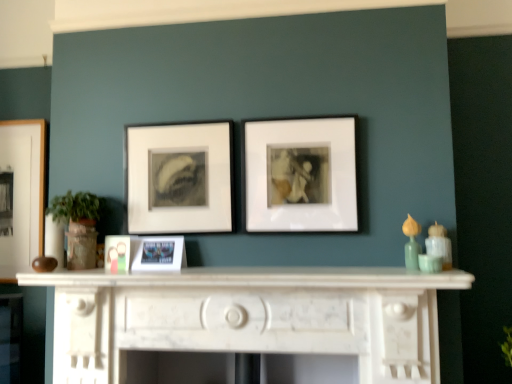
Question: In terms of size, does white matte picture frame at center, the 5th picture frame from the left, appear bigger or smaller than white marble fireplace at center?

Choices:
 (A) small
 (B) big

Answer: (A)

Question: In the image, is white matte picture frame at center, marked as the 1th picture frame in a right-to-left arrangement, positioned in front of or behind white marble fireplace at center?

Choices:
 (A) behind
 (B) front

Answer: (A)

Question: Which object is the farthest from the teal ceramic vase at right?

Choices:
 (A) wooden picture frame at left, the fifth picture frame positioned from the front
 (B) metallic silver photo frame at center, which is the 2th picture frame from front to back
 (C) white matte picture frame at center, the first picture frame in the front-to-back sequence
 (D) matte white frame at center, arranged as the second picture frame when viewed from the right
 (E) white marble fireplace at center

Answer: (A)

Question: Which of these objects is positioned closest to the white matte picture frame at center, the 5th picture frame from the left?

Choices:
 (A) matte white frame at center, which is the second picture frame in back-to-front order
 (B) teal ceramic vase at right
 (C) metallic silver photo frame at center, which appears as the 4th picture frame when viewed from the back
 (D) wooden picture frame at left, acting as the 1th picture frame starting from the left
 (E) matte plastic photo frame at center, marked as the third picture frame in a front-to-back arrangement

Answer: (A)